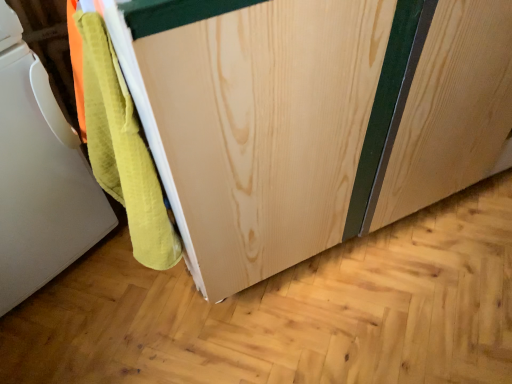
Where is `free location in front of natural wood cabinet at center`? free location in front of natural wood cabinet at center is located at coordinates (331, 322).